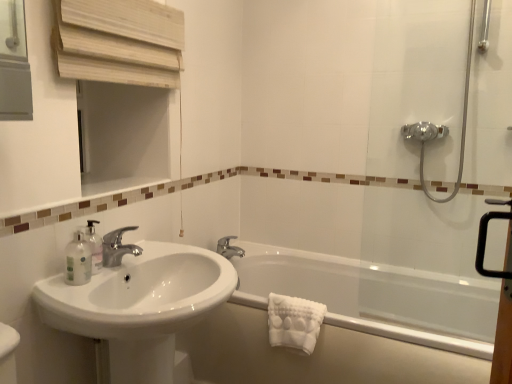
Question: Does silver metallic faucet at upper center, which is counted as the 2th tap, starting from the front, have a greater height compared to transparent glass shower door at right?

Choices:
 (A) yes
 (B) no

Answer: (B)

Question: Can you confirm if silver metallic faucet at upper center, placed as the 1th tap when sorted from back to front, is thinner than transparent glass shower door at right?

Choices:
 (A) yes
 (B) no

Answer: (A)

Question: From a real-world perspective, does silver metallic faucet at upper center, which appears as the 2th tap when viewed from the left, sit lower than transparent glass shower door at right?

Choices:
 (A) yes
 (B) no

Answer: (A)

Question: From a real-world perspective, is silver metallic faucet at upper center, placed as the 1th tap when sorted from back to front, located higher than transparent glass shower door at right?

Choices:
 (A) yes
 (B) no

Answer: (B)

Question: Is transparent glass shower door at right at the back of silver metallic faucet at upper center, placed as the 1th tap when sorted from back to front?

Choices:
 (A) yes
 (B) no

Answer: (B)

Question: Does point (366, 327) appear closer or farther from the camera than point (474, 11)?

Choices:
 (A) farther
 (B) closer

Answer: (B)

Question: From a real-world perspective, is white glossy bathtub at lower right positioned above or below transparent glass shower door at right?

Choices:
 (A) above
 (B) below

Answer: (B)

Question: Would you say white glossy bathtub at lower right is inside or outside transparent glass shower door at right?

Choices:
 (A) inside
 (B) outside

Answer: (B)

Question: From their relative heights in the image, would you say white glossy bathtub at lower right is taller or shorter than transparent glass shower door at right?

Choices:
 (A) tall
 (B) short

Answer: (B)

Question: In the image, is white textured towel at lower right positioned in front of or behind white glossy sink at lower left?

Choices:
 (A) behind
 (B) front

Answer: (A)

Question: Considering the positions of white textured towel at lower right and white glossy sink at lower left in the image, is white textured towel at lower right wider or thinner than white glossy sink at lower left?

Choices:
 (A) thin
 (B) wide

Answer: (A)

Question: In terms of height, does white textured towel at lower right look taller or shorter compared to white glossy sink at lower left?

Choices:
 (A) tall
 (B) short

Answer: (B)

Question: From a real-world perspective, relative to white glossy sink at lower left, is white textured towel at lower right vertically above or below?

Choices:
 (A) below
 (B) above

Answer: (B)

Question: Is polished chrome faucet at center, acting as the 2th tap starting from the back, spatially inside wooden medicine cabinet at upper left, or outside of it?

Choices:
 (A) outside
 (B) inside

Answer: (A)

Question: Is polished chrome faucet at center, acting as the first tap starting from the front, to the left or to the right of wooden medicine cabinet at upper left in the image?

Choices:
 (A) right
 (B) left

Answer: (B)